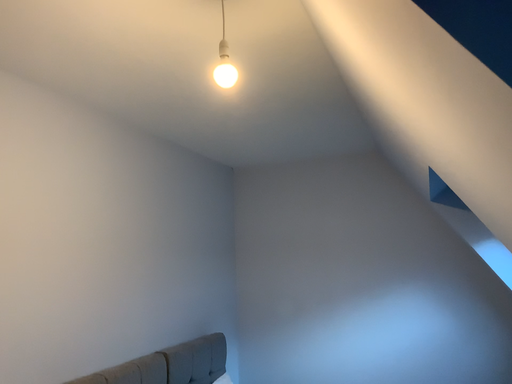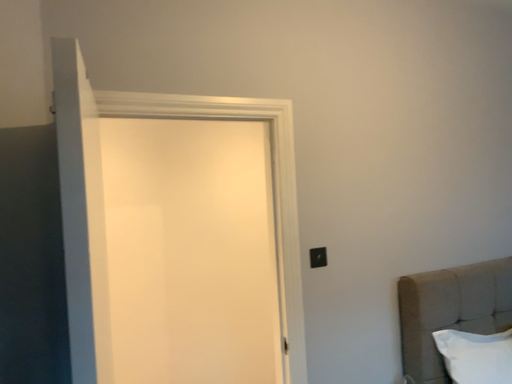
Question: Which way did the camera rotate in the video?

Choices:
 (A) rotated upward
 (B) rotated downward

Answer: (B)